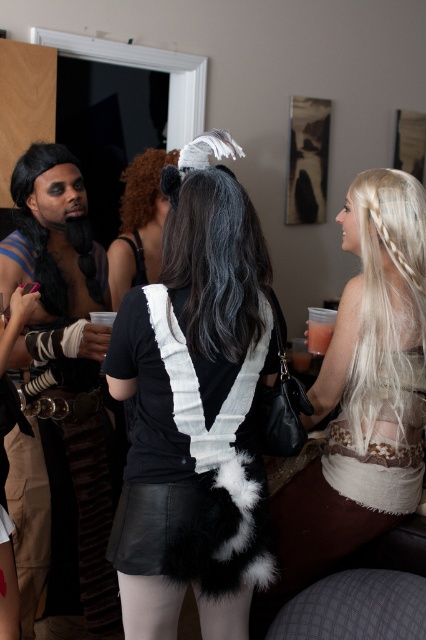
Question: In this image, where is satin white dress at right located relative to black synthetic wig at left?

Choices:
 (A) above
 (B) below

Answer: (B)

Question: Can you confirm if white fur vest at center is wider than curly brown wig at center?

Choices:
 (A) yes
 (B) no

Answer: (A)

Question: Is black synthetic wig at left wider than curly brown wig at center?

Choices:
 (A) no
 (B) yes

Answer: (A)

Question: Considering the real-world distances, which object is closest to the black leather wig at center?

Choices:
 (A) satin white dress at right
 (B) white fur vest at center
 (C) blonde hair at right
 (D) curly brown wig at center

Answer: (B)

Question: Among these objects, which one is nearest to the camera?

Choices:
 (A) satin white dress at right
 (B) black synthetic wig at left

Answer: (A)

Question: Which of the following is the closest to the observer?

Choices:
 (A) (146, 342)
 (B) (321, 353)
 (C) (216, 220)

Answer: (A)